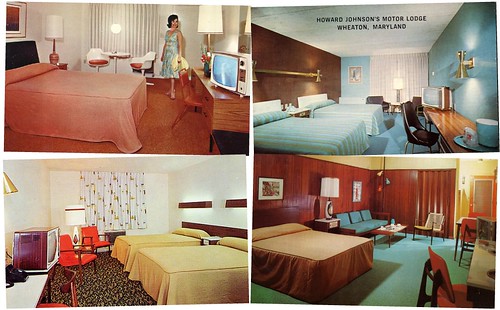
Identify the location of desk. (25, 284), (225, 105), (443, 119), (481, 264).